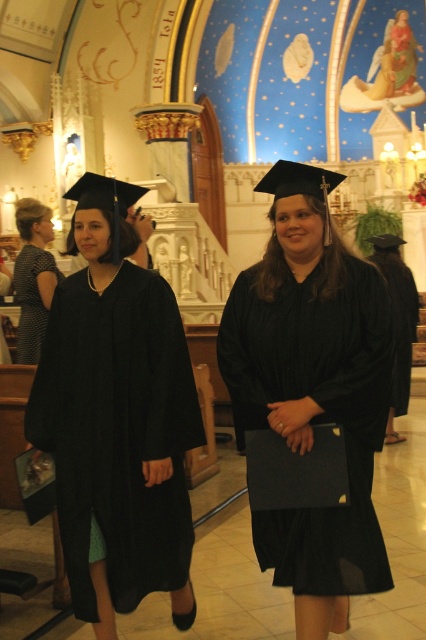
Question: Which object is positioned closest to the matte black graduation gown at center?

Choices:
 (A) matte black dress at left
 (B) matte black gown at center

Answer: (B)

Question: Can you confirm if matte black gown at center is bigger than matte black graduation gown at center?

Choices:
 (A) yes
 (B) no

Answer: (B)

Question: Which point is closer to the camera taking this photo?

Choices:
 (A) (189, 525)
 (B) (229, 372)

Answer: (A)

Question: Can you confirm if matte black gown at center is positioned above matte black graduation gown at center?

Choices:
 (A) yes
 (B) no

Answer: (B)

Question: Does matte black gown at center have a lesser width compared to matte black graduation gown at center?

Choices:
 (A) no
 (B) yes

Answer: (A)

Question: Which point appears closest to the camera in this image?

Choices:
 (A) (385, 378)
 (B) (23, 364)
 (C) (126, 362)

Answer: (A)